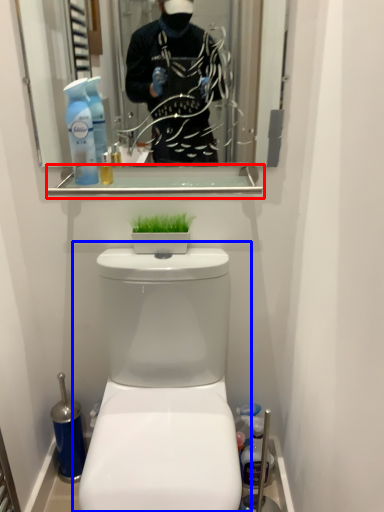
Question: Among these objects, which one is nearest to the camera, balustrade (highlighted by a red box) or toilet (highlighted by a blue box)?

Choices:
 (A) balustrade
 (B) toilet

Answer: (B)